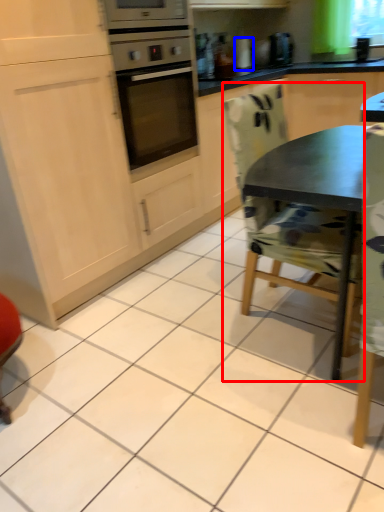
Question: Which object is closer to the camera taking this photo, chair (highlighted by a red box) or appliance (highlighted by a blue box)?

Choices:
 (A) chair
 (B) appliance

Answer: (A)